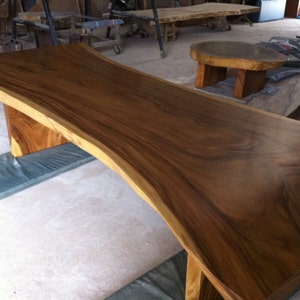
You are a GUI agent. You are given a task and a screenshot of the screen. Output one action in this format:
    pyautogui.click(x=<x>, y=<y>)
    Task: Click on the wall
    
    Given the screenshot: What is the action you would take?
    pyautogui.click(x=295, y=6)